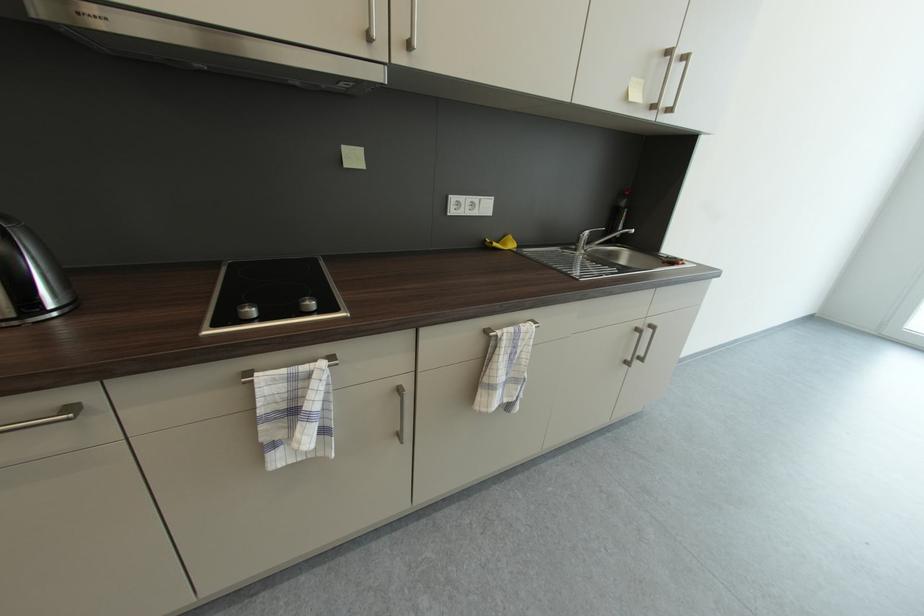
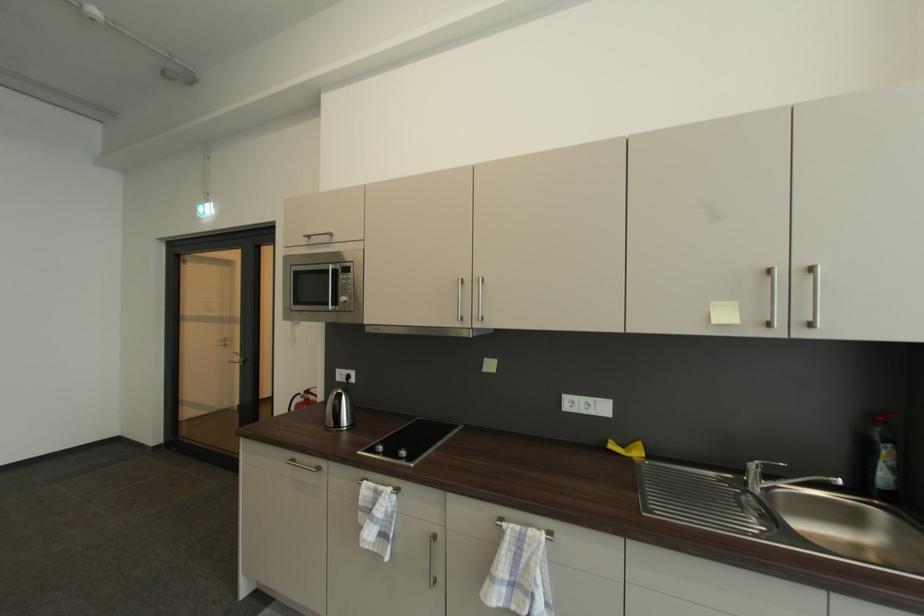
Find the pixel in the second image that matches the point at 633,195 in the first image.

(885, 419)